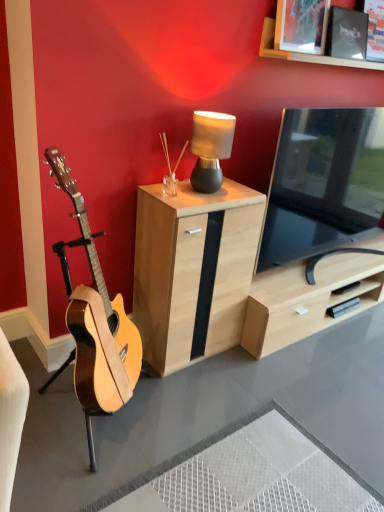
This screenshot has width=384, height=512. What are the coordinates of `free space above light wood cabinet at center (from a real-world perspective)` in the screenshot? It's located at (198, 192).